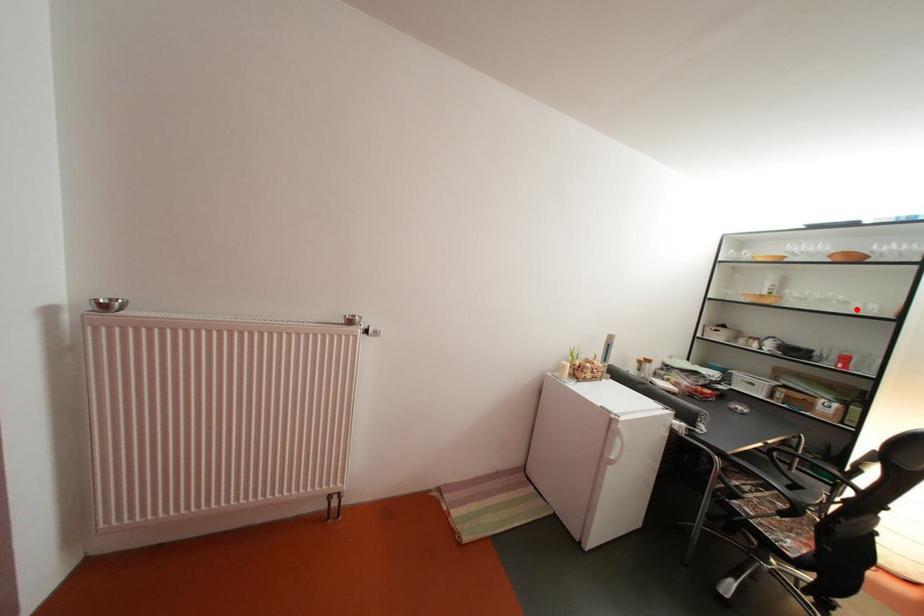
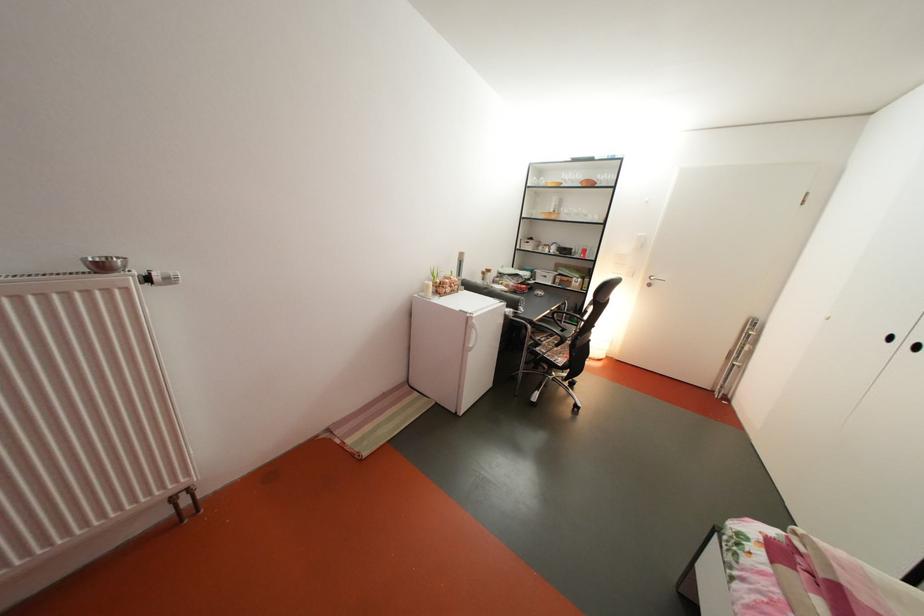
The point at the highlighted location is marked in the first image. Where is the corresponding point in the second image?

(598, 222)